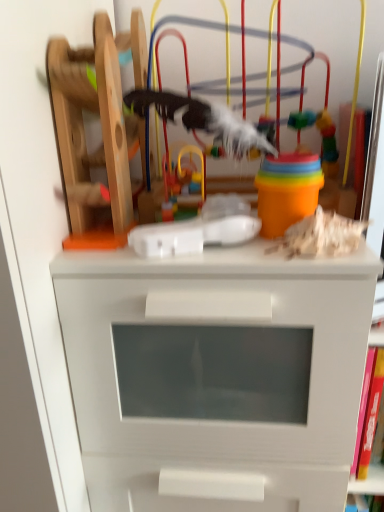
Locate an element on the screen. The width and height of the screenshot is (384, 512). empty space that is ontop of white matte chest of drawers at center (from a real-world perspective) is located at coordinates (206, 251).